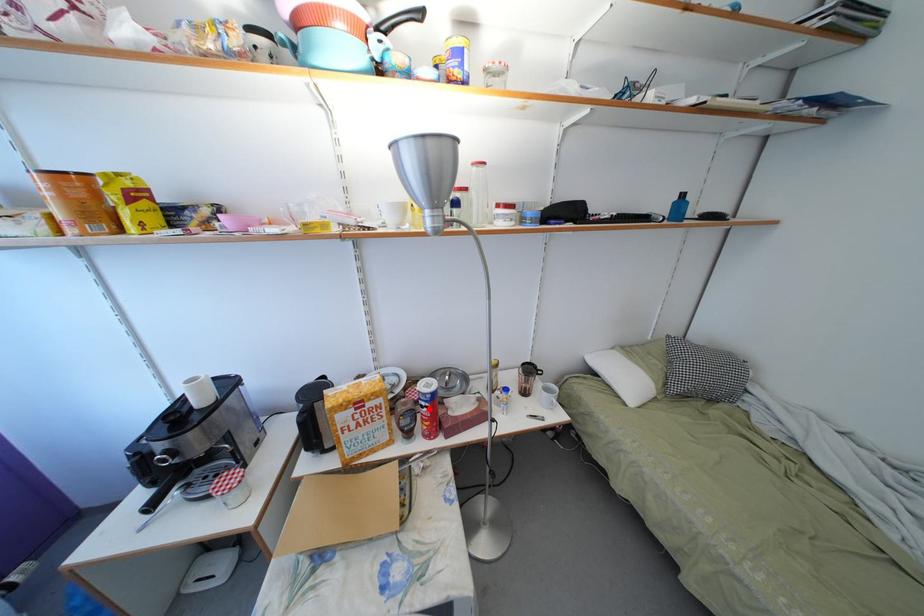
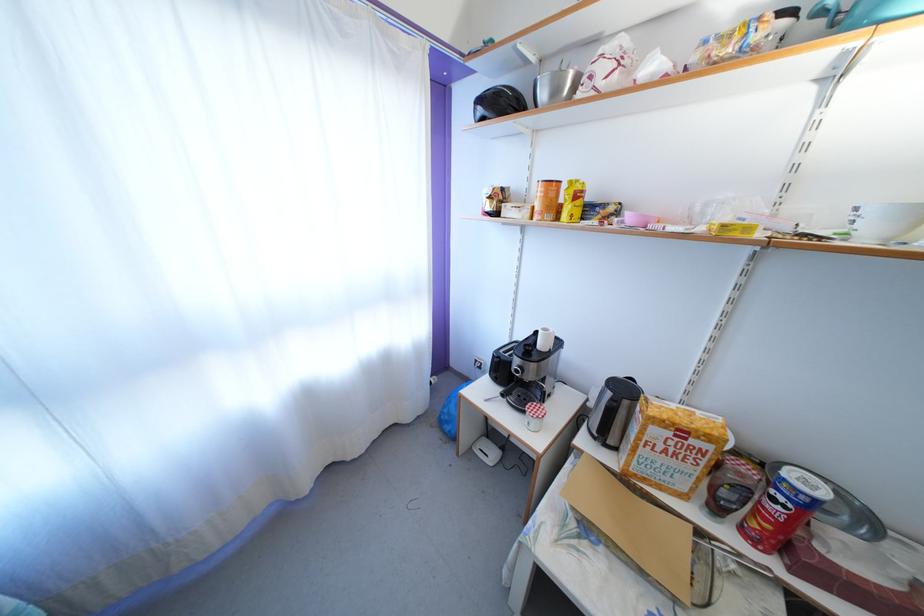
Where in the second image is the point corresponding to the highlighted location from the first image?

(786, 505)